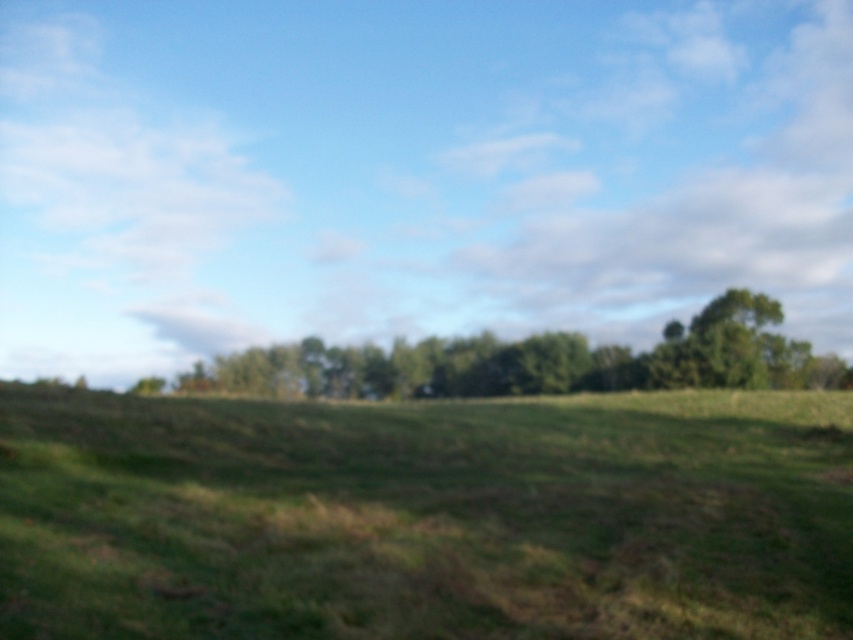
You are standing in the rural landscape and want to take a photo of both the green grassy field at center and the green leafy tree at center. Which object should you focus on first to ensure both are in sharp focus?

The green grassy field at center is in front of the green leafy tree at center. To ensure both are in sharp focus, you should focus on the green leafy tree at center because it is farther away, allowing the green grassy field at center to also be in focus within the depth of field.

You are standing at the origin point of the image coordinate system. Which direction should you move to reach the green grassy field at center?

The green grassy field at center is located at point (426, 516), so you should move towards the right and slightly forward to reach it.